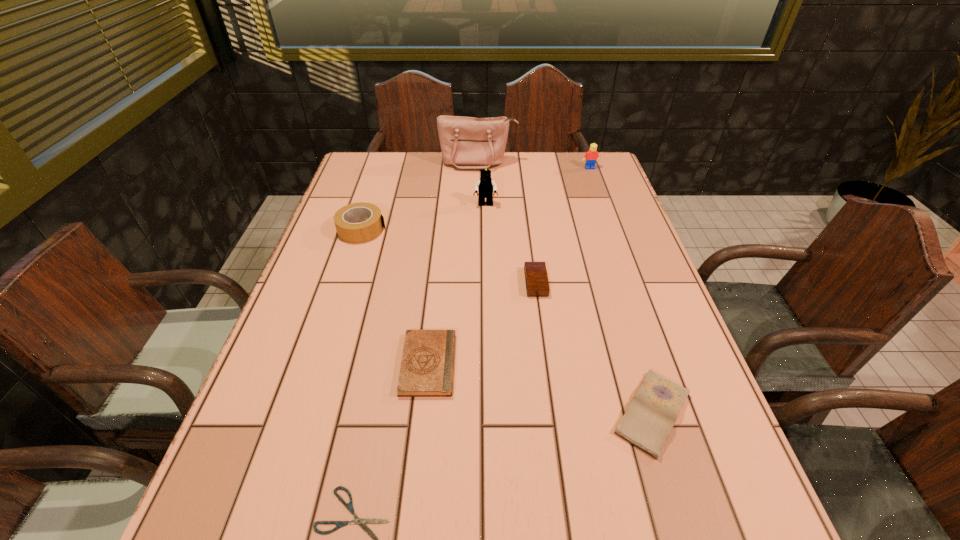
At what (x,y) coordinates should I click in order to perform the action: click on the left diary. Please return your answer as a coordinate pair (x, y). The image size is (960, 540). Looking at the image, I should click on (427, 365).

This screenshot has height=540, width=960. Find the location of `free space located on the front pocket of the shoulder bag`. free space located on the front pocket of the shoulder bag is located at coordinates (478, 184).

Where is `vacant space located 0.190m on the front-facing side of the sixth nearest object`? vacant space located 0.190m on the front-facing side of the sixth nearest object is located at coordinates (486, 249).

Where is `vacant space located on the face of the right Lego`? The image size is (960, 540). vacant space located on the face of the right Lego is located at coordinates (610, 222).

The width and height of the screenshot is (960, 540). I want to click on free space located at the edge of the leftmost object, so click(444, 230).

The image size is (960, 540). I want to click on blank space located 0.070m on the front face of the alarm clock, so click(x=497, y=282).

Image resolution: width=960 pixels, height=540 pixels. I want to click on free spot located 0.180m on the front face of the alarm clock, so click(x=452, y=282).

Find the location of a particular element. The image size is (960, 540). free space located on the front face of the alarm clock is located at coordinates (501, 282).

Find the location of a particular element. vacant space located 0.310m on the left of the right diary is located at coordinates (444, 413).

Locate an element on the screen. vacant space located on the spine side of the left diary is located at coordinates (600, 364).